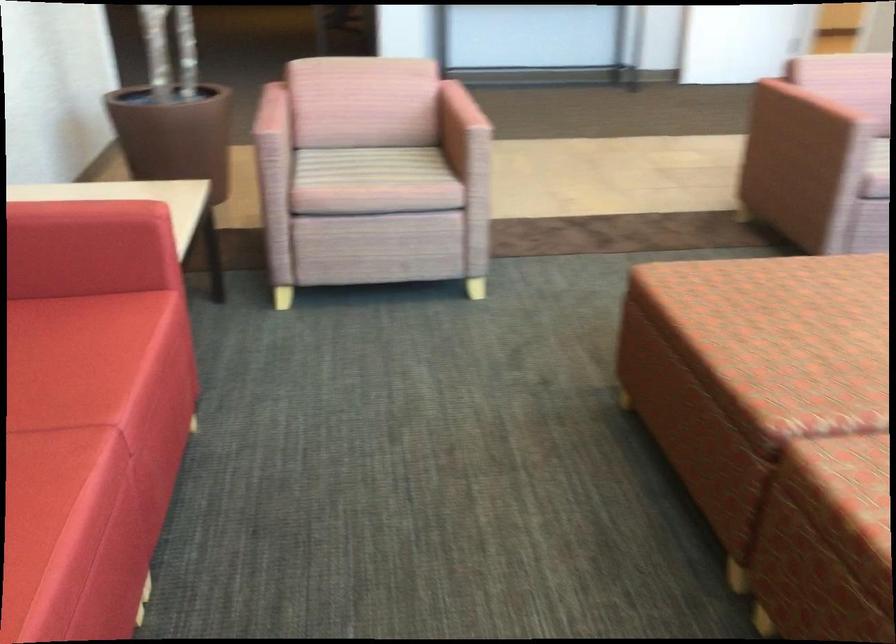
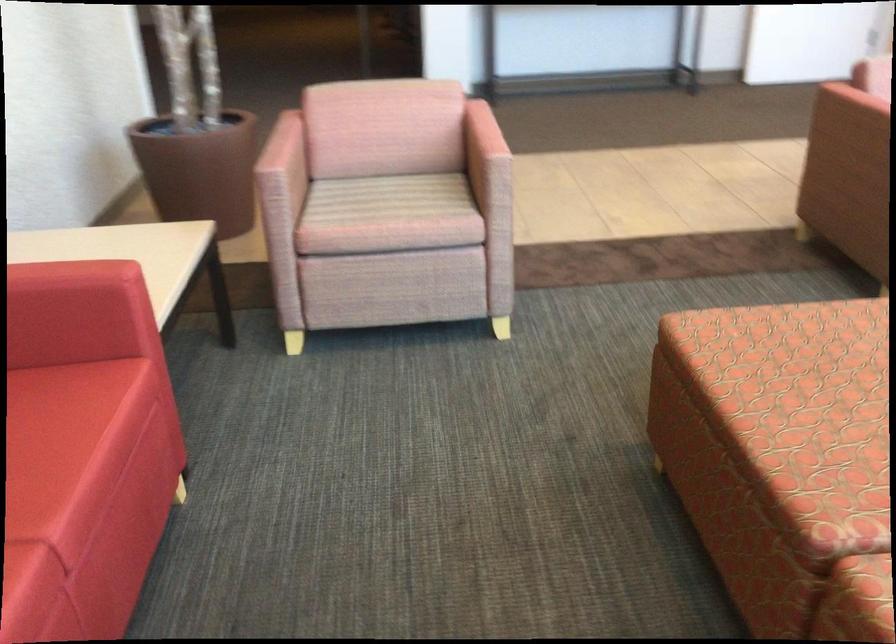
Where in the second image is the point corresponding to pixel 738 292 from the first image?

(782, 350)